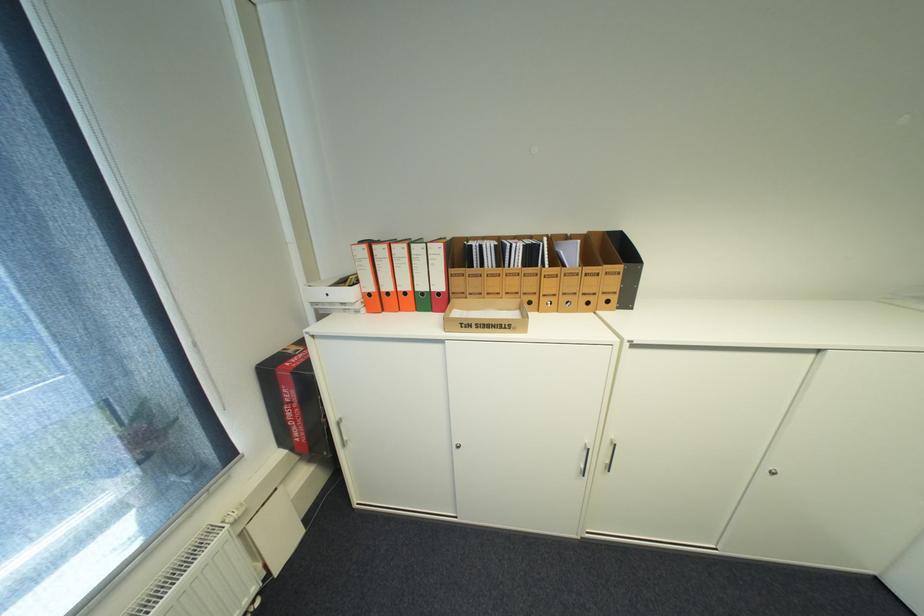
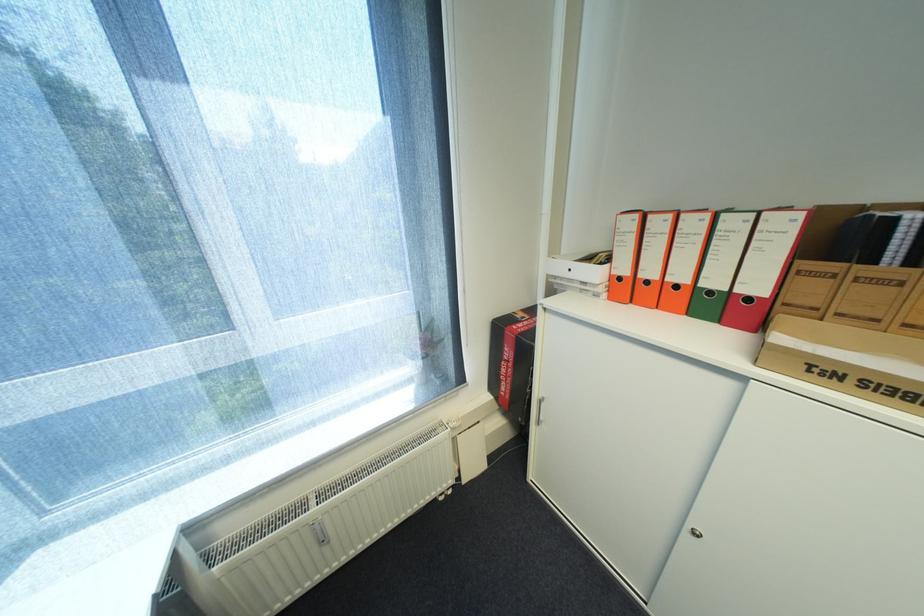
The point at (395, 294) is marked in the first image. Where is the corresponding point in the second image?

(655, 283)